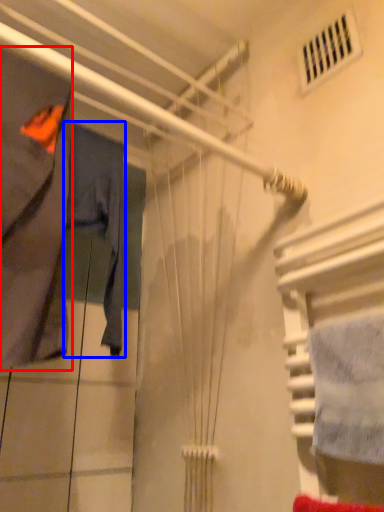
Question: Which of the following is the farthest to the observer, clothing (highlighted by a red box) or clothing (highlighted by a blue box)?

Choices:
 (A) clothing
 (B) clothing

Answer: (B)